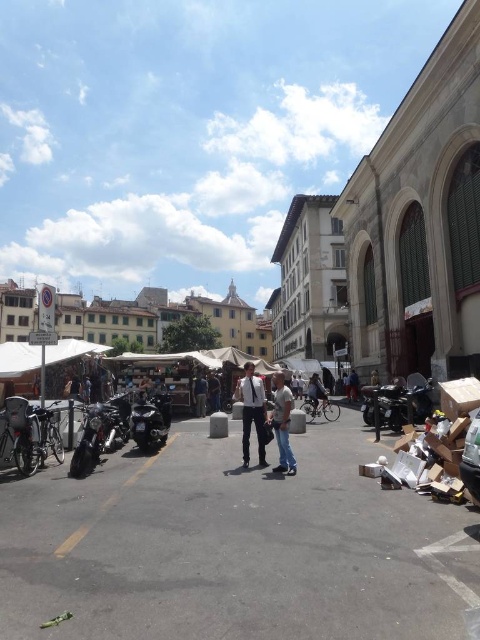
You are a delivery person who needs to place a package between the dark blue jeans at center and the dark gray fabric jacket at center. Since you can only place it to the left of the jacket, will the package be placed to the right or left of the jeans?

The dark blue jeans at center are to the left of the dark gray fabric jacket at center. Since you can only place the package to the left of the jacket, the package will be placed to the right of the jeans.